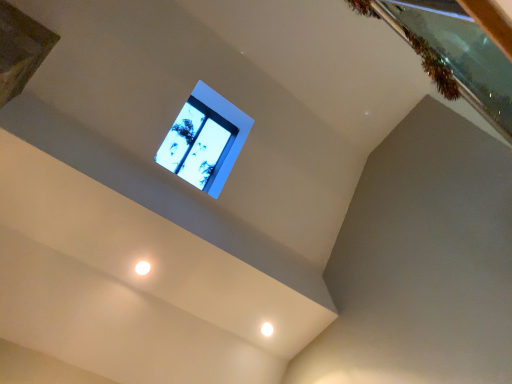
Where is `white glossy light at lower center`? Image resolution: width=512 pixels, height=384 pixels. white glossy light at lower center is located at coordinates (267, 329).

Describe the element at coordinates (267, 329) in the screenshot. The width and height of the screenshot is (512, 384). I see `white glossy light at lower center` at that location.

I want to click on white glossy light at lower center, so click(267, 329).